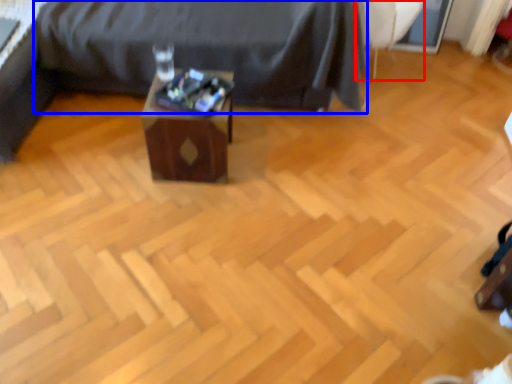
Question: Which of the following is the closest to the observer, swivel chair (highlighted by a red box) or furniture (highlighted by a blue box)?

Choices:
 (A) swivel chair
 (B) furniture

Answer: (B)